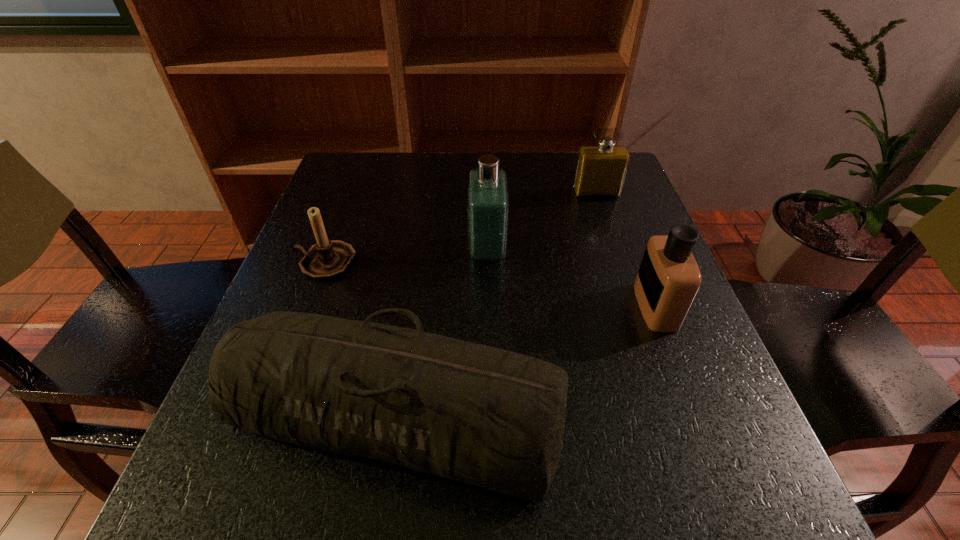
The image size is (960, 540). Identify the location of vacant position in the image that satisfies the following two spatial constraints: 1. on the front-facing side of the farthest object; 2. on the front label of the second farthest perfume. (615, 251).

The width and height of the screenshot is (960, 540). I want to click on vacant position in the image that satisfies the following two spatial constraints: 1. on the front side of the nearest object; 2. on the right side of the candle holder, so click(x=268, y=413).

In order to click on free space that satisfies the following two spatial constraints: 1. on the front-facing side of the farthest perfume; 2. on the front label of the second nearest perfume in this screenshot , I will do `click(615, 251)`.

The height and width of the screenshot is (540, 960). I want to click on free location that satisfies the following two spatial constraints: 1. on the front-facing side of the farthest perfume; 2. on the front label of the tallest perfume, so click(x=615, y=251).